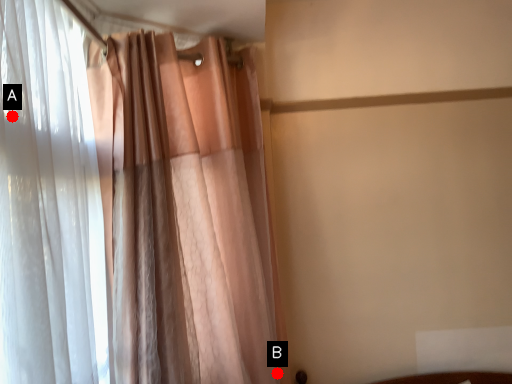
Question: Two points are circled on the image, labeled by A and B beside each circle. Which of the following is the farthest from the observer?

Choices:
 (A) A is further
 (B) B is further

Answer: (B)